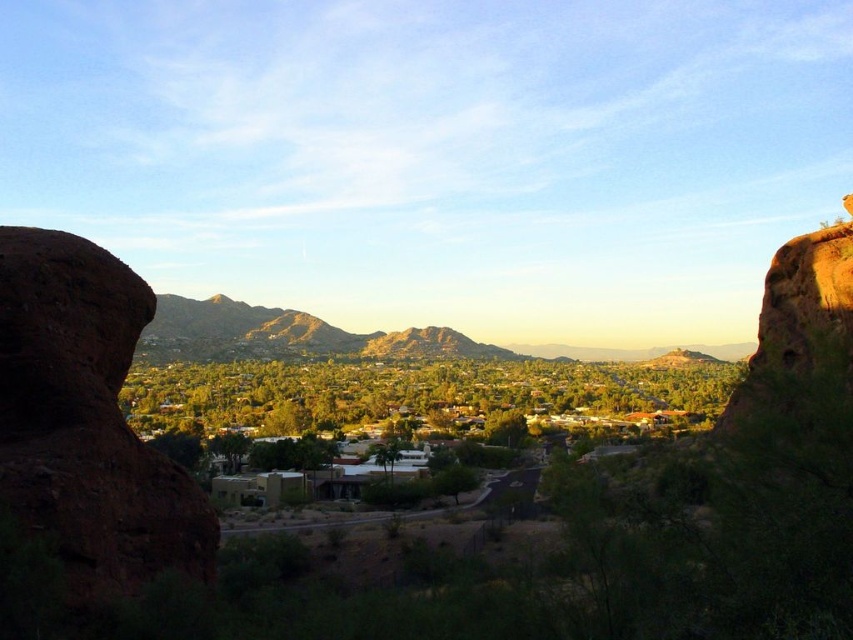
You are an explorer navigating through the desert and come across this landscape. You need to cross from the brown rough rock at left to the green grassy valley at center. Which direction should you head to reach the valley?

To reach the green grassy valley at center from the brown rough rock at left, you should head to the right since the brown rough rock at left is located to the left of the green grassy valley at center.

Based on the photo, you are a hiker planning to take a photo of the rustic brown mountain at center. You notice the brown rough rock at left is blocking your view. Can you move around the rock to get an unobstructed view of the mountain?

The brown rough rock at left is in front of rustic brown mountain at center, so moving around the rock could provide an unobstructed view of the mountain.

You are planning a hiking route through the landscape shown. You need to decide whether to prioritize the green grassy valley at center or the rustic brown mountain at center based on their sizes. Which area should you choose if you want to cover a larger area in your hike?

The rustic brown mountain at center occupies more space than the green grassy valley at center, so choosing the rustic brown mountain at center would allow you to cover a larger area during your hike.